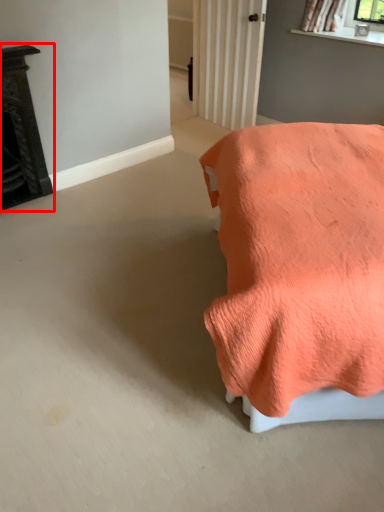
Question: In this image, where is furniture (annotated by the red box) located relative to furniture?

Choices:
 (A) left
 (B) right

Answer: (A)